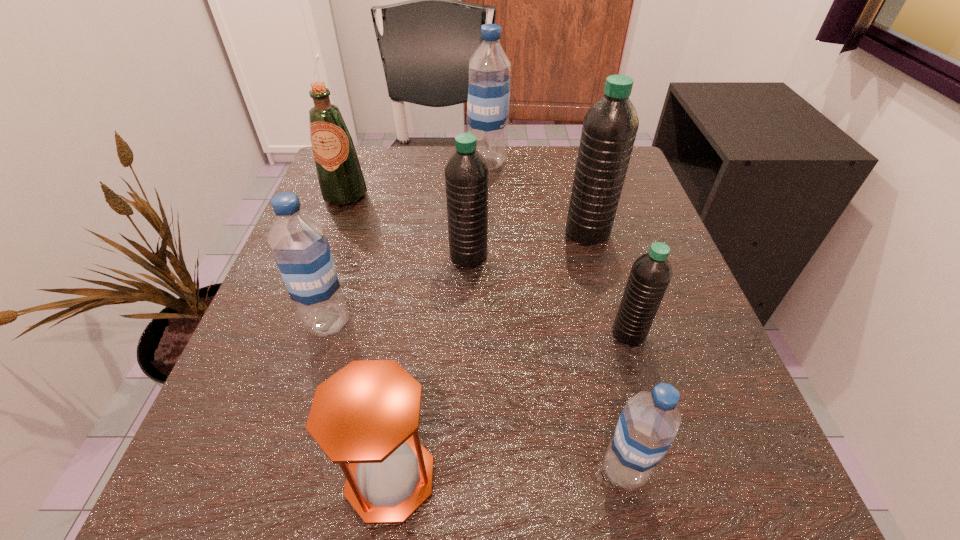
Image resolution: width=960 pixels, height=540 pixels. Find the location of `the rightmost blue water bottle`. the rightmost blue water bottle is located at coordinates (648, 424).

Locate an element on the screen. brown hourglass is located at coordinates (367, 414).

This screenshot has width=960, height=540. I want to click on hourglass, so click(x=367, y=414).

Find the location of a particular element. The height and width of the screenshot is (540, 960). vacant space positioned 0.190m on the label of the second blue water bottle from left to right is located at coordinates (388, 163).

This screenshot has width=960, height=540. In order to click on free space located 0.310m on the label of the second blue water bottle from left to right in this screenshot , I will do `click(338, 163)`.

Find the location of a particular element. This screenshot has height=540, width=960. vacant point located on the label of the second blue water bottle from left to right is located at coordinates (430, 163).

This screenshot has height=540, width=960. Identify the location of free space located 0.390m on the front of the biggest black water bottle. (645, 446).

Locate an element on the screen. This screenshot has height=540, width=960. vacant space located on the front-facing side of the seventh nearest object is located at coordinates (314, 279).

This screenshot has width=960, height=540. What are the coordinates of `vacant space located 0.100m on the front of the leftmost black water bottle` in the screenshot? It's located at pos(468,311).

The width and height of the screenshot is (960, 540). What are the coordinates of `free point located on the label of the leftmost water bottle` in the screenshot? It's located at (298, 420).